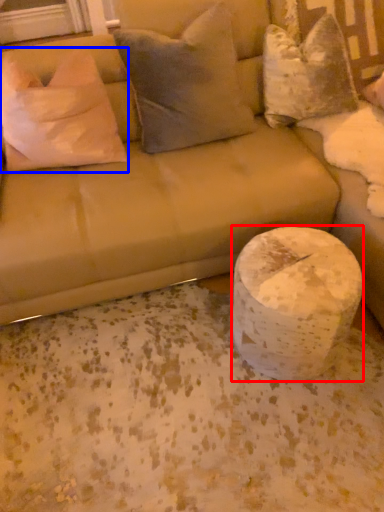
Question: Which object appears closest to the camera in this image, marble (highlighted by a red box) or pillow (highlighted by a blue box)?

Choices:
 (A) marble
 (B) pillow

Answer: (A)